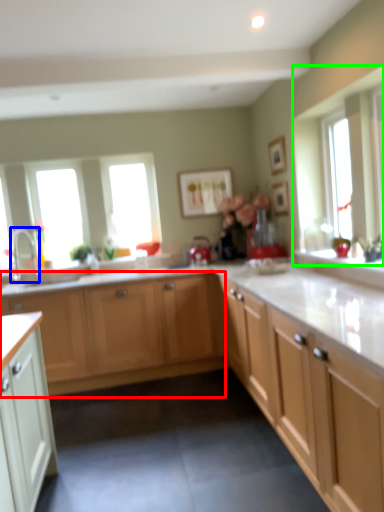
Question: Based on their relative distances, which object is nearer to cabinetry (highlighted by a red box)? Choose from tap (highlighted by a blue box) and window (highlighted by a green box).

Choices:
 (A) tap
 (B) window

Answer: (A)